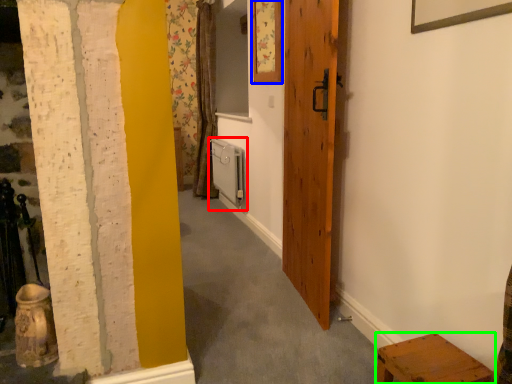
Question: Which object is positioned farthest from radiator (highlighted by a red box)? Select from picture frame (highlighted by a blue box) and furniture (highlighted by a green box).

Choices:
 (A) picture frame
 (B) furniture

Answer: (B)